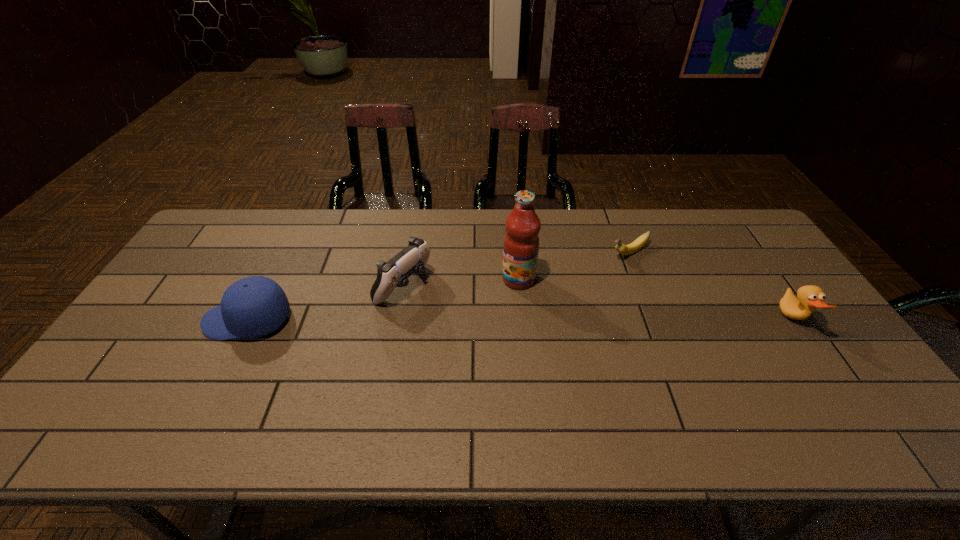
This screenshot has width=960, height=540. I want to click on vacant spot on the desktop that is between the leftmost object and the duck and is positioned on the front-facing side of the second object from left to right, so click(x=469, y=320).

What are the coordinates of `free space on the desktop that is between the leftmost object and the rightmost object and is positioned at the stem of the fourth object from left to right` in the screenshot? It's located at (510, 320).

Where is `vacant space on the desktop that is between the cap and the duck and is positioned on the front label of the tallest object`? vacant space on the desktop that is between the cap and the duck and is positioned on the front label of the tallest object is located at coordinates (452, 320).